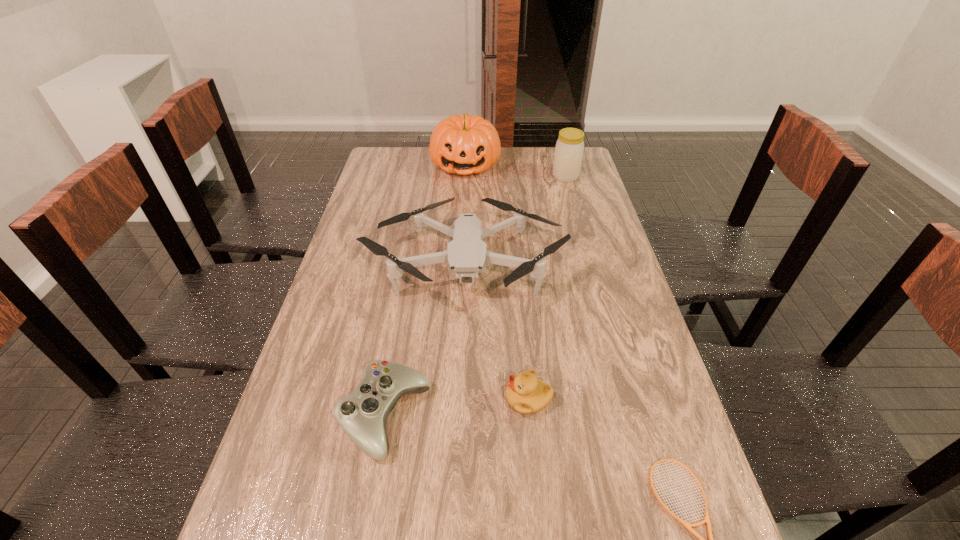
At what (x,y) coordinates should I click in order to perform the action: click on vacant area at the right edge of the desktop. Please return your answer as a coordinate pair (x, y). Looking at the image, I should click on (584, 228).

In order to click on vacant space at the far left corner of the desktop in this screenshot , I will do `click(380, 161)`.

Identify the location of empty location between the duckling and the third tallest object. This screenshot has width=960, height=540. (496, 331).

The height and width of the screenshot is (540, 960). Find the location of `empty space between the control and the third farthest object`. empty space between the control and the third farthest object is located at coordinates (425, 340).

Identify the location of unoccupied area between the jar and the duckling. The image size is (960, 540). (547, 287).

Point out which object is positioned as the second nearest to the duckling. Please provide its 2D coordinates. Your answer should be formatted as a tuple, i.e. [(x, y)], where the tuple contains the x and y coordinates of a point satisfying the conditions above.

[(467, 254)]

Locate which object ranks fourth in proximity to the pumpkin. Please provide its 2D coordinates. Your answer should be formatted as a tuple, i.e. [(x, y)], where the tuple contains the x and y coordinates of a point satisfying the conditions above.

[(525, 393)]